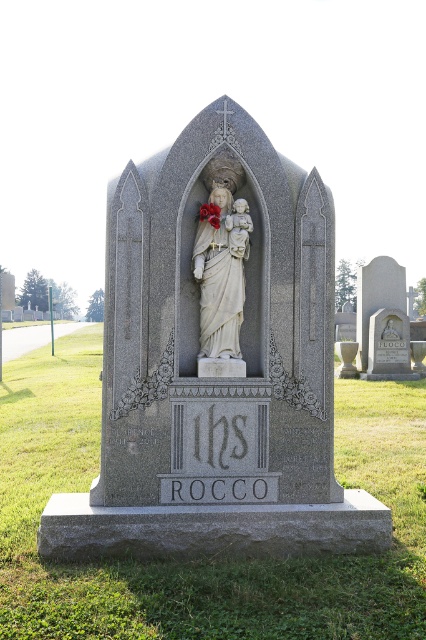
Consider the image. You are standing in front of the tombstone monument in the cemetery. There is a point marked at coordinates (218, 324). What is located at that point?

The point at coordinates (218, 324) indicates the location of the gray stone statue at center.

You are an archaeologist examining two statues in a cemetery. You notice a gray stone statue at center and a white marble statue at center. Which statue is taller?

The gray stone statue at center is taller than the white marble statue at center.

You are an art conservator assessing two statues in a cemetery. You see the gray stone statue at center and the white marble statue at center. Which statue requires a larger protective covering to prevent weathering?

The gray stone statue at center is larger in size than the white marble statue at center, so it requires a larger protective covering to prevent weathering.